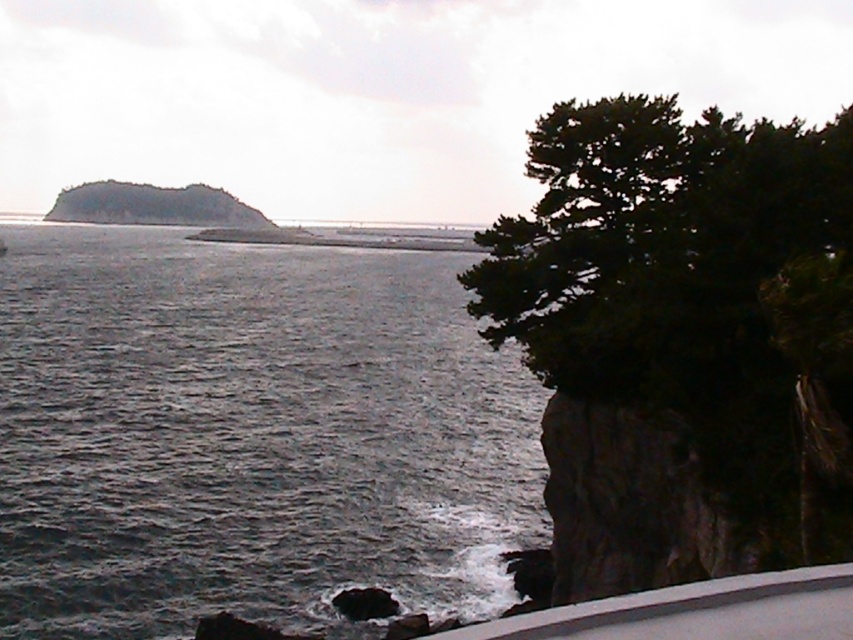
I want to click on dark gray water at center, so click(x=248, y=435).

Is dark gray water at center in front of dark gray rocky island at upper left?

That is True.

Who is more forward, (332, 593) or (68, 196)?

Point (332, 593) is in front.

You are a GUI agent. You are given a task and a screenshot of the screen. Output one action in this format:
    pyautogui.click(x=<x>, y=<y>)
    Task: Click on the dark gray water at center
    The image size is (853, 640).
    Given the screenshot: What is the action you would take?
    pyautogui.click(x=248, y=435)

Does dark gray water at center appear over dark green leafy tree at right?

No, dark gray water at center is not above dark green leafy tree at right.

Can you confirm if dark gray water at center is taller than dark green leafy tree at right?

Correct, dark gray water at center is much taller as dark green leafy tree at right.

Locate an element on the screen. dark gray water at center is located at coordinates (248, 435).

Image resolution: width=853 pixels, height=640 pixels. Find the location of `dark gray water at center`. dark gray water at center is located at coordinates [248, 435].

Who is positioned more to the left, dark green leafy tree at right or dark gray rocky island at upper left?

Positioned to the left is dark gray rocky island at upper left.

Is point (575, 342) positioned after point (71, 188)?

No.

Where is `dark green leafy tree at right`? dark green leafy tree at right is located at coordinates (689, 285).

Where is `dark green leafy tree at right`? The width and height of the screenshot is (853, 640). dark green leafy tree at right is located at coordinates (689, 285).